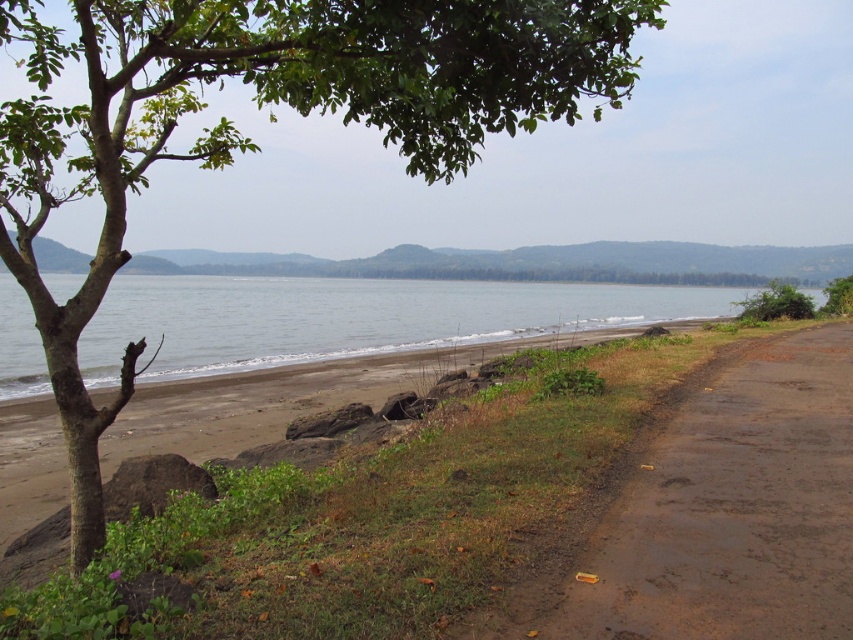
Question: Which of these objects is positioned farthest from the green leafy tree at right?

Choices:
 (A) dull brown asphalt at lower right
 (B) green leafy tree at left

Answer: (B)

Question: Where is green leafy tree at left located in relation to dull brown asphalt at lower right in the image?

Choices:
 (A) left
 (B) right

Answer: (A)

Question: Estimate the real-world distances between objects in this image. Which object is farther from the green leafy tree at right?

Choices:
 (A) green leafy tree at left
 (B) gray smooth water at center
 (C) dull brown asphalt at lower right

Answer: (A)

Question: Does green leafy tree at left have a greater width compared to gray smooth water at center?

Choices:
 (A) yes
 (B) no

Answer: (A)

Question: Which is nearer to the dull brown asphalt at lower right?

Choices:
 (A) green leafy tree at left
 (B) gray smooth water at center

Answer: (A)

Question: Is green leafy tree at left positioned at the back of green leafy tree at right?

Choices:
 (A) yes
 (B) no

Answer: (B)